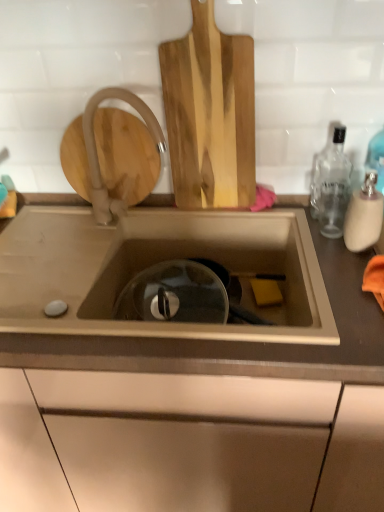
Find the location of `unoccupied region to the right of natural wood cutting board at upper center`. unoccupied region to the right of natural wood cutting board at upper center is located at coordinates (280, 216).